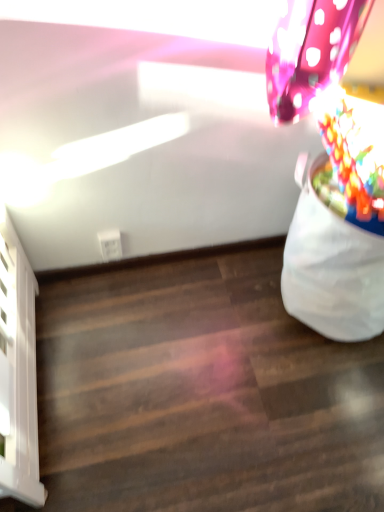
Question: In the image, is wooden floor at lower right positioned in front of or behind multicolored plastic flower at upper right?

Choices:
 (A) front
 (B) behind

Answer: (B)

Question: Is wooden floor at lower right situated inside multicolored plastic flower at upper right or outside?

Choices:
 (A) inside
 (B) outside

Answer: (B)

Question: Considering the real-world distances, which object is farthest from the multicolored plastic flower at upper right?

Choices:
 (A) white fabric bean bag at right
 (B) wooden floor at lower right

Answer: (B)

Question: Which object is the farthest from the wooden floor at lower right?

Choices:
 (A) multicolored plastic flower at upper right
 (B) white fabric bean bag at right

Answer: (A)